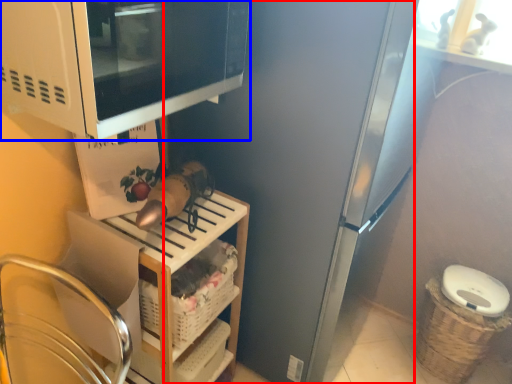
Question: Which object appears closest to the camera in this image, appliance (highlighted by a red box) or microwave oven (highlighted by a blue box)?

Choices:
 (A) appliance
 (B) microwave oven

Answer: (B)